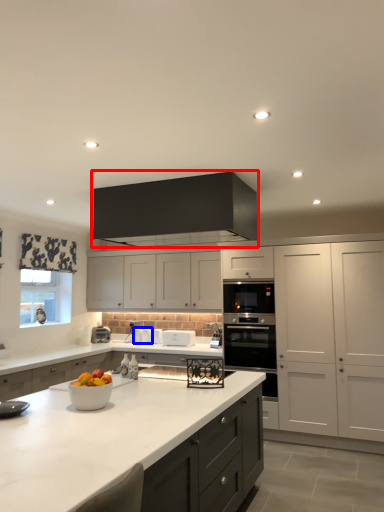
Question: Which object is closer to the camera taking this photo, cabinetry (highlighted by a red box) or appliance (highlighted by a blue box)?

Choices:
 (A) cabinetry
 (B) appliance

Answer: (A)